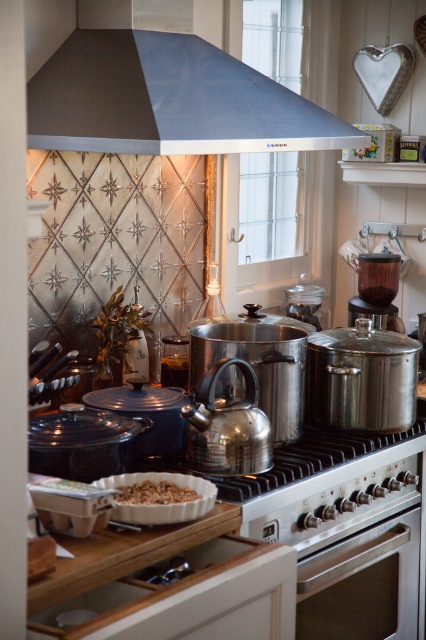
You are a chef preparing a meal and notice both the stainless steel oven at lower center and the brown crumbly at center in your kitchen. Which object is located to the right of the other?

The stainless steel oven at lower center is positioned on the right side of brown crumbly at center, so the oven is to the right of the crumbly.

You are a chef who needs to clean up the kitchen. You see the stainless steel oven at lower center and the brown crumbly at center. How far apart are these two items?

The distance between the stainless steel oven at lower center and the brown crumbly at center is 78.56 centimeters.

You are a chef standing in the kitchen and want to reach the satin steel exhaust hood at upper center to clean it. If your maximum arm extension allows you to reach up to 1.8 meters, will you be able to reach it?

The satin steel exhaust hood at upper center is 2.10 meters away from the viewer, which is beyond the chef can reach with a maximum arm extension of 1.8 meters. Therefore, the chef cannot reach it.